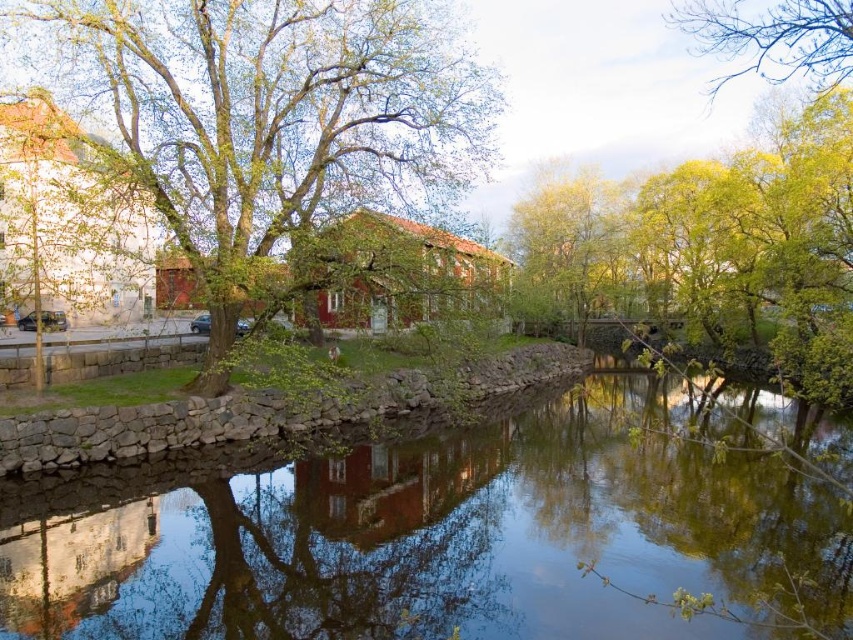
Question: Which object is positioned closest to the yellow-green leaves at upper center?

Choices:
 (A) green leafy tree at upper left
 (B) green leafy tree at upper right

Answer: (A)

Question: Which object is farther from the camera taking this photo?

Choices:
 (A) green leafy tree at upper left
 (B) green leafy tree at upper right

Answer: (B)

Question: Can you confirm if green leafy tree at upper left is thinner than yellow-green leaves at upper center?

Choices:
 (A) no
 (B) yes

Answer: (B)

Question: Is green leafy tree at upper left below green leafy tree at upper right?

Choices:
 (A) no
 (B) yes

Answer: (B)

Question: Is green leafy tree at upper left to the left of yellow-green leaves at upper center from the viewer's perspective?

Choices:
 (A) no
 (B) yes

Answer: (B)

Question: Which point is farther to the camera?

Choices:
 (A) (834, 29)
 (B) (206, 80)
 (C) (486, 550)

Answer: (B)